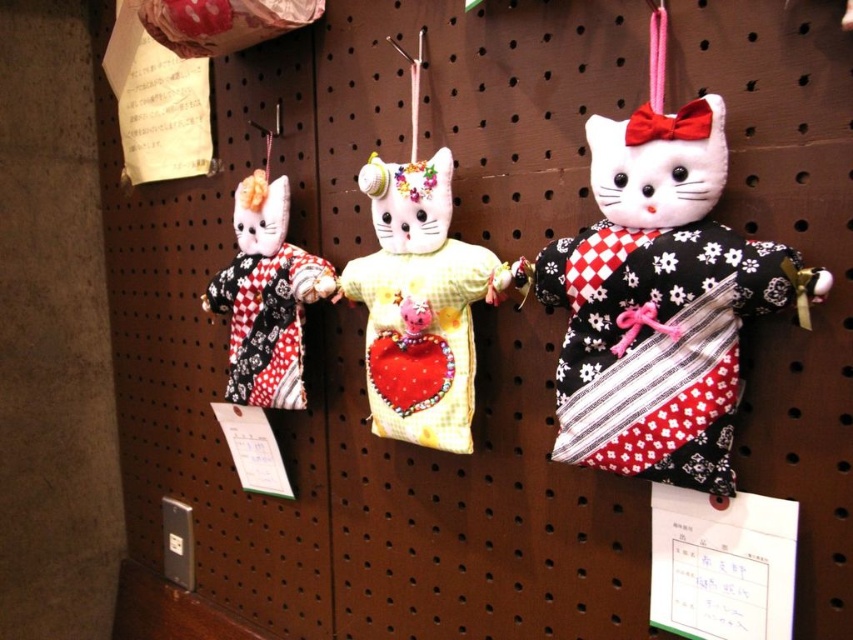
Question: Which object is the farthest from the yellow fabric cat at center?

Choices:
 (A) matte black kimono at right
 (B) matte black and white kimono cat at left

Answer: (A)

Question: Which point appears farthest from the camera in this image?

Choices:
 (A) (236, 214)
 (B) (401, 273)

Answer: (A)

Question: Is matte black kimono at right wider than matte black and white kimono cat at left?

Choices:
 (A) yes
 (B) no

Answer: (A)

Question: Is yellow fabric cat at center thinner than matte black and white kimono cat at left?

Choices:
 (A) yes
 (B) no

Answer: (A)

Question: Among these objects, which one is farthest from the camera?

Choices:
 (A) matte black kimono at right
 (B) matte black and white kimono cat at left
 (C) yellow fabric cat at center

Answer: (B)

Question: Can you confirm if matte black kimono at right is smaller than matte black and white kimono cat at left?

Choices:
 (A) no
 (B) yes

Answer: (B)